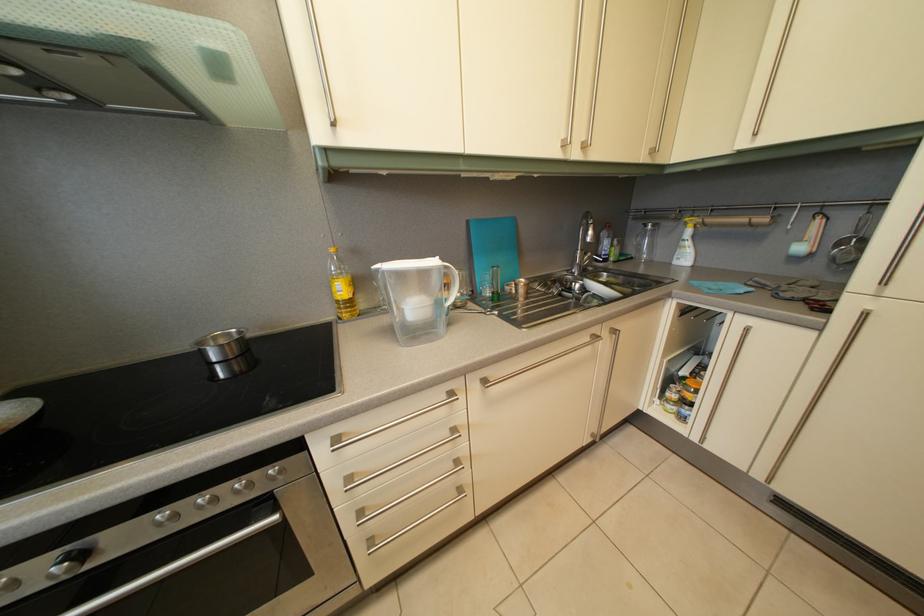
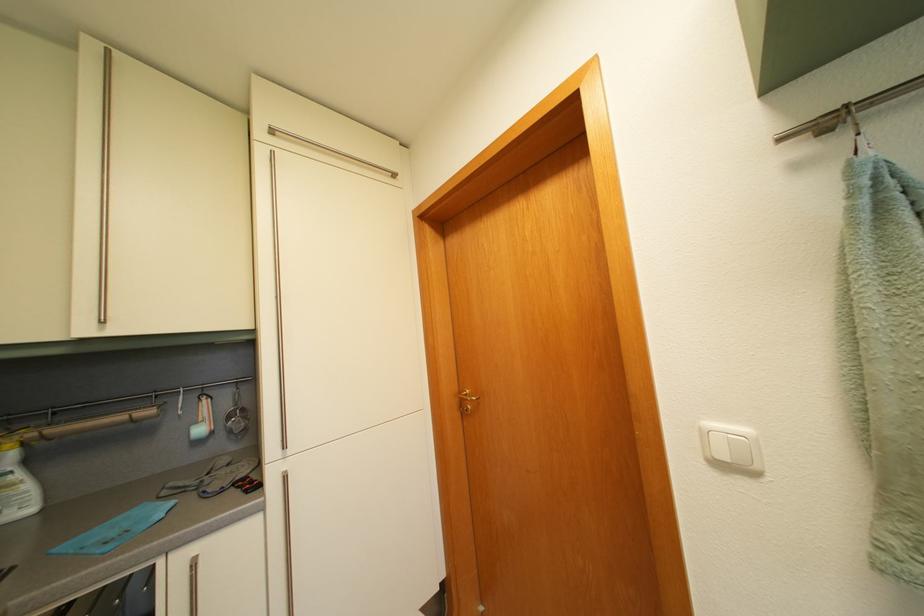
Where in the second image is the point corresponding to [697,251] from the first image?

(26, 484)